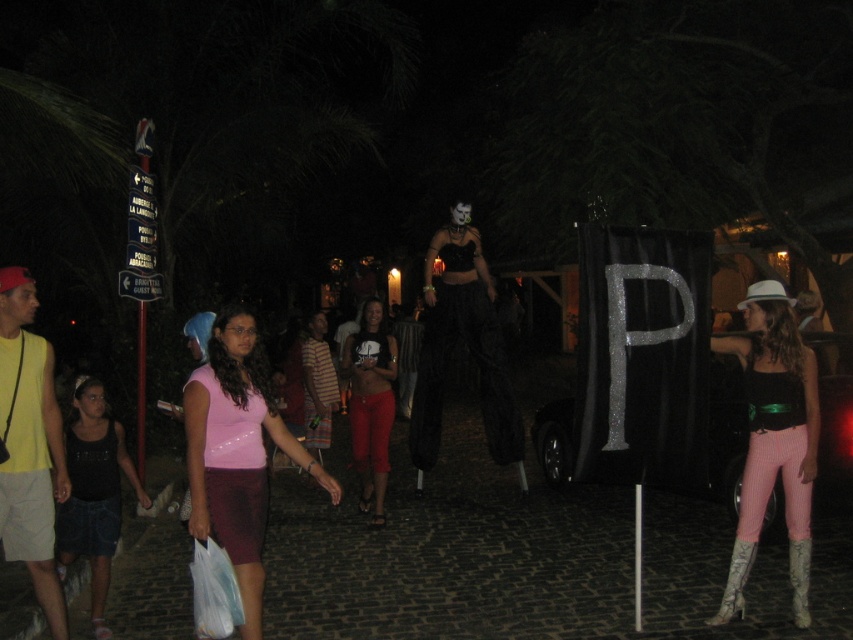
You are at a party and see two skirts in the scene. The pink glossy skirt at center and the denim skirt at lower left. Which skirt is closer to you?

The pink glossy skirt at center is closer to the viewer than the denim skirt at lower left.

You are standing at the point labeled point (90, 429) and want to move towards the camera. Which direction should you move to get closer to the camera without moving past the point labeled point (216, 428)?

You should move towards the point labeled point (216, 428) because it is closer to the camera than point (90, 429).